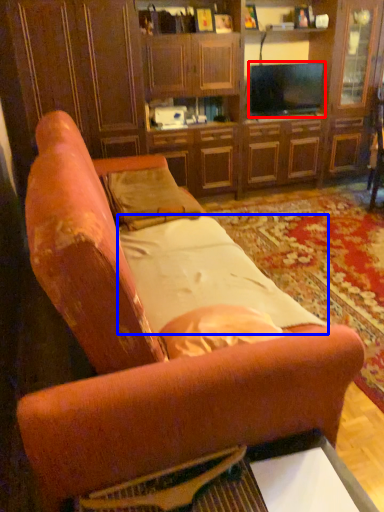
Question: Which object appears farthest to the camera in this image, television (highlighted by a red box) or sheet (highlighted by a blue box)?

Choices:
 (A) television
 (B) sheet

Answer: (A)